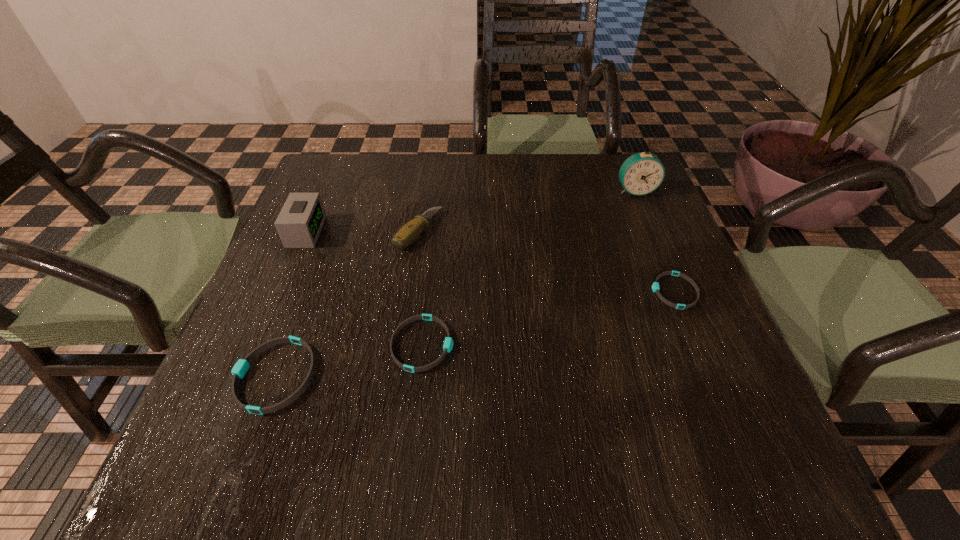
In order to click on the third tallest object in this screenshot , I will do `click(408, 233)`.

Image resolution: width=960 pixels, height=540 pixels. In order to click on vacant area situated 0.280m on the buckle of the second wristband from left to right in this screenshot , I will do `click(603, 345)`.

You are a GUI agent. You are given a task and a screenshot of the screen. Output one action in this format:
    pyautogui.click(x=<x>, y=<y>)
    Task: Click on the vacant space located 0.300m on the buckle of the shortest wristband
    The image size is (960, 540).
    Given the screenshot: What is the action you would take?
    pyautogui.click(x=508, y=291)

Find the location of `vacant space situated on the buckle of the shortest wristband`. vacant space situated on the buckle of the shortest wristband is located at coordinates (561, 291).

Locate an element on the screen. This screenshot has width=960, height=540. vacant point located on the buckle of the shortest wristband is located at coordinates (589, 291).

Find the location of `vacant space located on the front-facing side of the shorter alarm clock`. vacant space located on the front-facing side of the shorter alarm clock is located at coordinates (375, 232).

Locate an element on the screen. free space located 0.250m on the front-facing side of the farthest object is located at coordinates (666, 265).

This screenshot has height=540, width=960. What are the coordinates of `free region located on the back of the third tallest object` in the screenshot? It's located at (430, 153).

Where is `object situated at the far edge`? This screenshot has width=960, height=540. object situated at the far edge is located at coordinates (642, 173).

The image size is (960, 540). In order to click on wristband that is at the left edge in this screenshot , I will do coord(239,370).